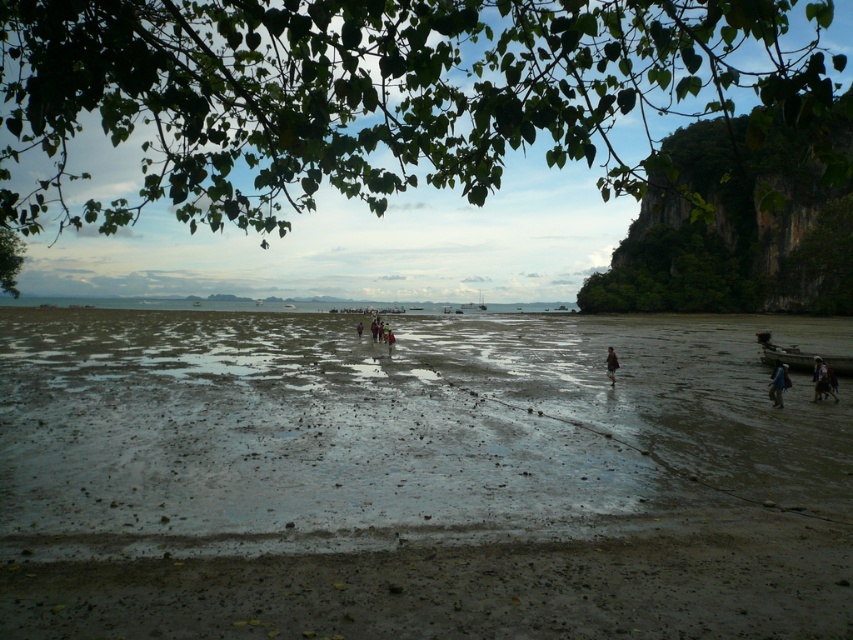
You are standing on the beach and see the blue fabric bag at lower right and the dark blue jeans at center. Which object is positioned more to the east if the sun is setting in the west?

The blue fabric bag at lower right is positioned more to the east because it is to the right of the dark blue jeans at center, and since the sun is setting in the west, the right side of the image faces east.

You are a photographer standing on the beach and want to take a photo of the dark blue jeans at center without the blue fabric bag at lower right appearing in the frame. Is this possible based on their positions?

The blue fabric bag at lower right is positioned under the dark blue jeans at center, so it would be visible in the photo. To avoid capturing the bag, you need to adjust your angle or move the bag.